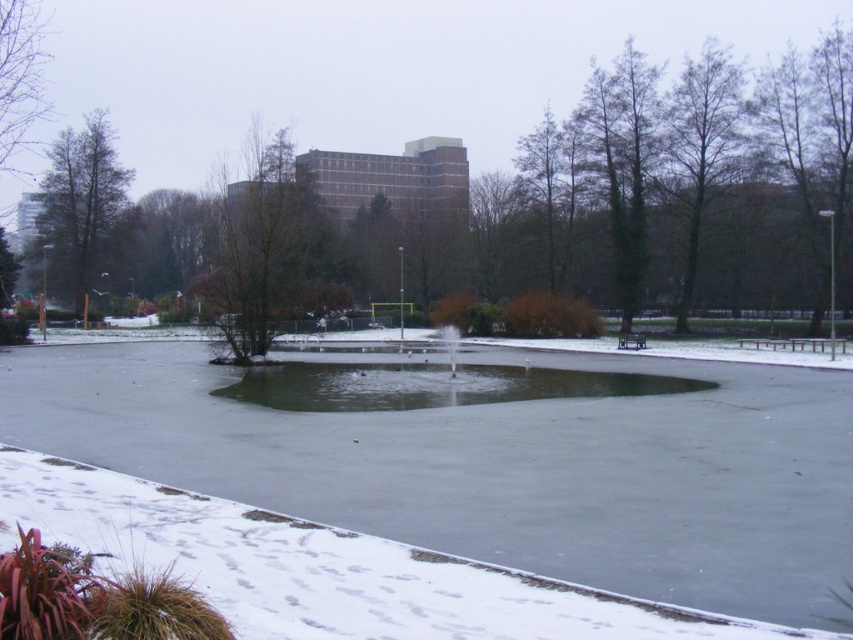
In the scene shown: You are standing at the snow path leading to the pond and want to reach the green matte tree at center. What direction should you walk to get there?

The green matte tree at center is located at point (265, 250), so you should walk towards the center of the image to reach it.

You are standing at the point labeled point [265,250] in the winter scene. What object are you touching?

You are touching the green matte tree at center because the point [265,250] is on it.